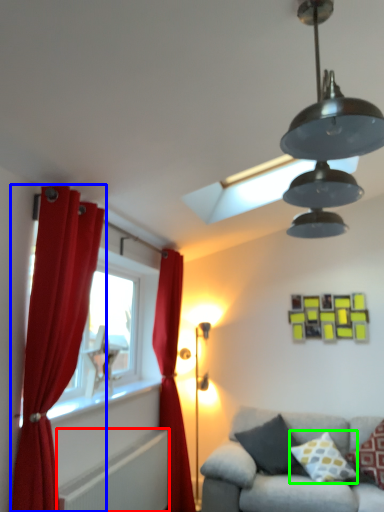
Question: Considering the real-world distances, which object is farthest from radiator (highlighted by a red box)? curtain (highlighted by a blue box) or pillow (highlighted by a green box)?

Choices:
 (A) curtain
 (B) pillow

Answer: (B)